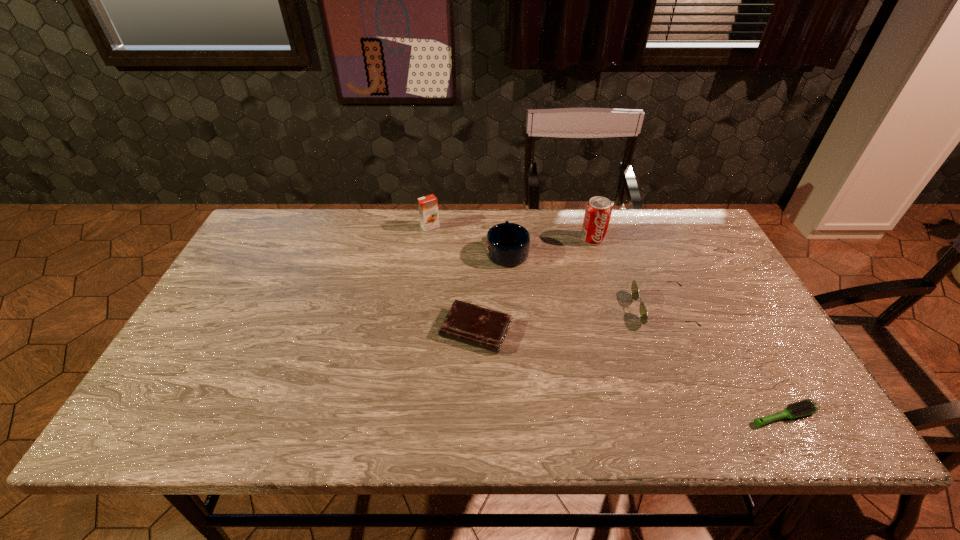
Locate an element on the screen. This screenshot has height=540, width=960. orange juice that is at the far edge is located at coordinates (428, 205).

You are a GUI agent. You are given a task and a screenshot of the screen. Output one action in this format:
    pyautogui.click(x=<x>, y=<y>)
    Task: Click on the mug situated at the far edge
    The image size is (960, 540).
    Given the screenshot: What is the action you would take?
    pyautogui.click(x=507, y=244)

The image size is (960, 540). Identify the location of object that is positioned at the near edge. (805, 407).

Find the location of a particular element. This screenshot has width=960, height=540. object located at the right edge is located at coordinates (805, 407).

The width and height of the screenshot is (960, 540). Identify the location of object located in the near right corner section of the desktop. (805, 407).

Locate an element on the screen. free space at the far edge of the desktop is located at coordinates (644, 218).

This screenshot has width=960, height=540. What are the coordinates of `vacant space at the near edge of the desktop` in the screenshot? It's located at (372, 438).

Where is `free location at the left edge`? The height and width of the screenshot is (540, 960). free location at the left edge is located at coordinates (170, 368).

In the image, there is a desktop. What are the coordinates of `vacant space at the right edge` in the screenshot? It's located at (780, 364).

The height and width of the screenshot is (540, 960). In the image, there is a desktop. Identify the location of free region at the far left corner. (262, 225).